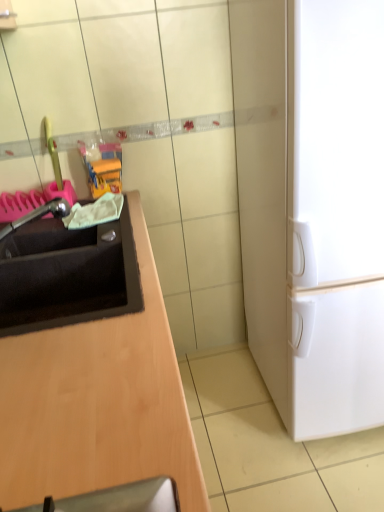
Question: Should I look upward or downward to see satin nickel faucet at left?

Choices:
 (A) down
 (B) up

Answer: (B)

Question: Does satin nickel faucet at left lie in front of black matte sink at left?

Choices:
 (A) no
 (B) yes

Answer: (A)

Question: Considering the relative sizes of satin nickel faucet at left and black matte sink at left in the image provided, is satin nickel faucet at left smaller than black matte sink at left?

Choices:
 (A) yes
 (B) no

Answer: (A)

Question: From the image's perspective, is satin nickel faucet at left located beneath black matte sink at left?

Choices:
 (A) no
 (B) yes

Answer: (A)

Question: Would you say satin nickel faucet at left is outside black matte sink at left?

Choices:
 (A) yes
 (B) no

Answer: (A)

Question: Is satin nickel faucet at left behind black matte sink at left?

Choices:
 (A) no
 (B) yes

Answer: (B)

Question: Is satin nickel faucet at left oriented towards black matte sink at left?

Choices:
 (A) no
 (B) yes

Answer: (A)

Question: Does white matte refrigerator at right have a lesser width compared to satin nickel faucet at left?

Choices:
 (A) no
 (B) yes

Answer: (A)

Question: Can you confirm if white matte refrigerator at right is taller than satin nickel faucet at left?

Choices:
 (A) no
 (B) yes

Answer: (B)

Question: Could you tell me if white matte refrigerator at right is facing satin nickel faucet at left?

Choices:
 (A) yes
 (B) no

Answer: (B)

Question: From a real-world perspective, is white matte refrigerator at right below satin nickel faucet at left?

Choices:
 (A) no
 (B) yes

Answer: (B)

Question: Is white matte refrigerator at right positioned beyond the bounds of satin nickel faucet at left?

Choices:
 (A) yes
 (B) no

Answer: (A)

Question: Is white matte refrigerator at right shorter than satin nickel faucet at left?

Choices:
 (A) no
 (B) yes

Answer: (A)

Question: Does black matte sink at left have a lesser height compared to white matte refrigerator at right?

Choices:
 (A) yes
 (B) no

Answer: (A)